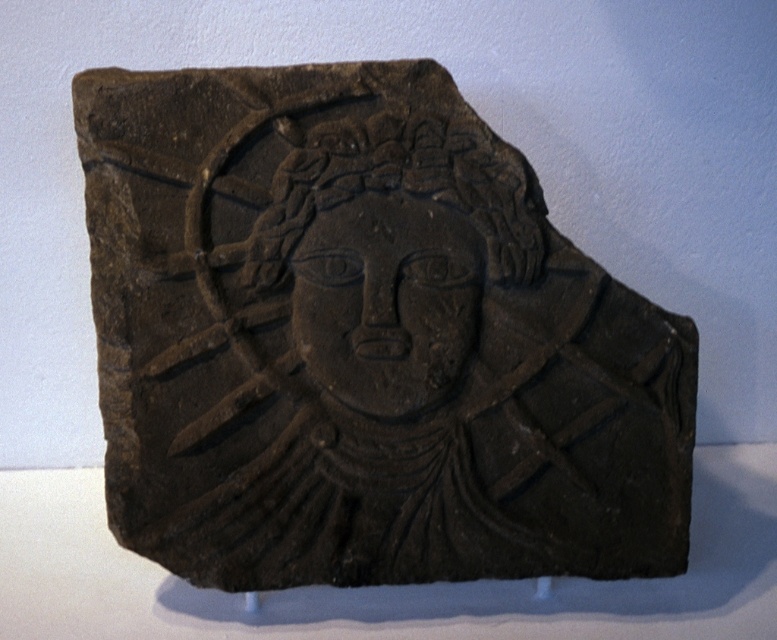
Question: Does dark stone carving at center have a lesser width compared to matte black face at center?

Choices:
 (A) yes
 (B) no

Answer: (B)

Question: Does dark stone carving at center come in front of matte black face at center?

Choices:
 (A) yes
 (B) no

Answer: (B)

Question: Which of the following is the closest to the observer?

Choices:
 (A) (319, 419)
 (B) (410, 381)

Answer: (B)

Question: Which point appears farthest from the camera in this image?

Choices:
 (A) (140, 339)
 (B) (401, 352)

Answer: (A)

Question: Considering the relative positions of dark stone carving at center and matte black face at center in the image provided, where is dark stone carving at center located with respect to matte black face at center?

Choices:
 (A) below
 (B) above

Answer: (A)

Question: Among these points, which one is farthest from the camera?

Choices:
 (A) (330, 285)
 (B) (532, 550)

Answer: (B)